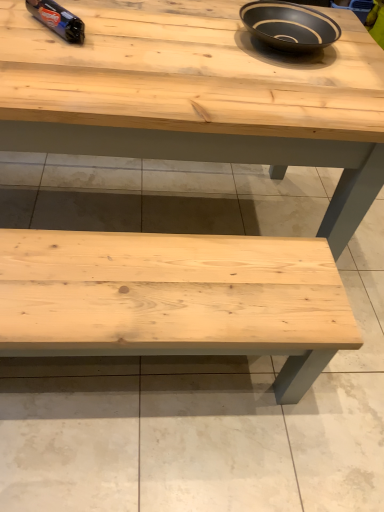
Locate an element on the screen. The width and height of the screenshot is (384, 512). vacant area situated to the left side of black matte bowl at upper center is located at coordinates (206, 24).